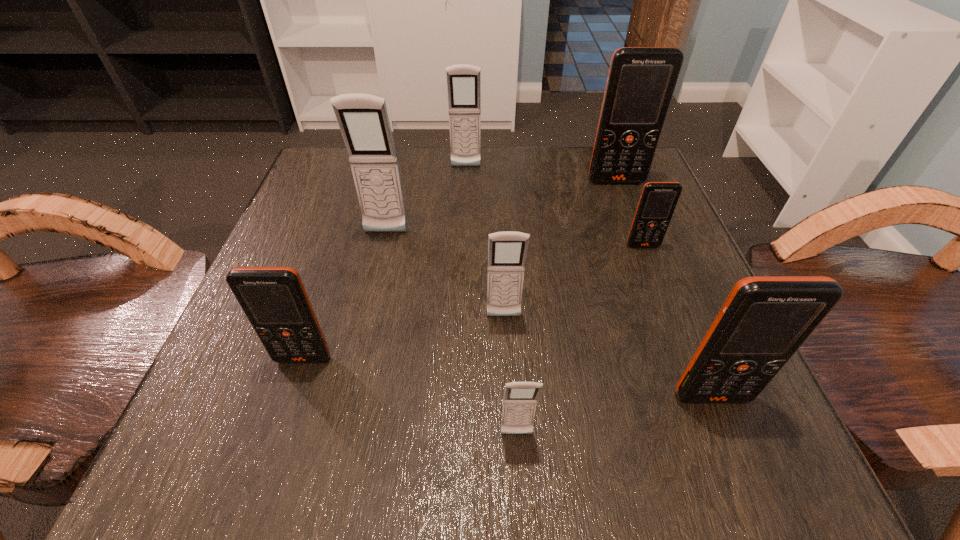
Find the location of a particular element. The image size is (960, 540). free space at the near left corner of the desktop is located at coordinates (279, 408).

You are a GUI agent. You are given a task and a screenshot of the screen. Output one action in this format:
    pyautogui.click(x=<x>, y=<y>)
    Task: Click on the unoccupied area between the biggest orange cellular telephone and the fifth nearest object
    
    Given the screenshot: What is the action you would take?
    630,214

Where is `empty location between the second nearest object and the sixth nearest object`? The height and width of the screenshot is (540, 960). empty location between the second nearest object and the sixth nearest object is located at coordinates (549, 315).

You are a GUI agent. You are given a task and a screenshot of the screen. Output one action in this format:
    pyautogui.click(x=<x>, y=<y>)
    Task: Click on the empty location between the second farthest cellular telephone and the third cellular telephone from left to right
    The height and width of the screenshot is (540, 960).
    Given the screenshot: What is the action you would take?
    point(541,174)

Identify the location of free space between the biggest orange cellular telephone and the farthest object. (541, 174).

The width and height of the screenshot is (960, 540). What are the coordinates of `empty space between the third gray cellular telephone from right to left and the second nearest orange cellular telephone` in the screenshot? It's located at (385, 263).

The height and width of the screenshot is (540, 960). Find the location of `free space between the fifth farthest cellular telephone and the farthest gray cellular telephone`. free space between the fifth farthest cellular telephone and the farthest gray cellular telephone is located at coordinates (485, 242).

You are a GUI agent. You are given a task and a screenshot of the screen. Output one action in this format:
    pyautogui.click(x=<x>, y=<y>)
    Task: Click on the free space between the farthest cellular telephone and the farthest orange cellular telephone
    This screenshot has height=540, width=960.
    Given the screenshot: What is the action you would take?
    pyautogui.click(x=541, y=174)

Identify the location of empty location between the third farthest cellular telephone and the second biggest orange cellular telephone. (549, 315).

Where is `vacant space in between the nearest gray cellular telephone and the second farthest orange cellular telephone`? The image size is (960, 540). vacant space in between the nearest gray cellular telephone and the second farthest orange cellular telephone is located at coordinates (580, 340).